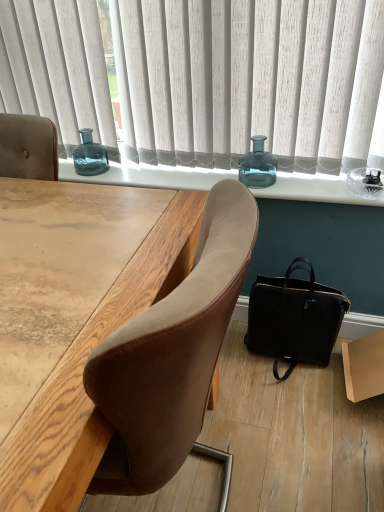
Question: Considering the relative sizes of teal glass bottle at upper center, which is counted as the first bottle, starting from the back, and brown cardboard box at lower right in the image provided, is teal glass bottle at upper center, which is counted as the first bottle, starting from the back, taller than brown cardboard box at lower right?

Choices:
 (A) yes
 (B) no

Answer: (B)

Question: Does teal glass bottle at upper center, arranged as the 2th bottle when viewed from the front, lie in front of brown cardboard box at lower right?

Choices:
 (A) yes
 (B) no

Answer: (B)

Question: From the image's perspective, is teal glass bottle at upper center, which is counted as the first bottle, starting from the back, located beneath brown cardboard box at lower right?

Choices:
 (A) no
 (B) yes

Answer: (A)

Question: Is teal glass bottle at upper center, the 2th bottle viewed from the right, positioned beyond the bounds of brown cardboard box at lower right?

Choices:
 (A) yes
 (B) no

Answer: (A)

Question: Is teal glass bottle at upper center, the 2th bottle viewed from the right, turned away from brown cardboard box at lower right?

Choices:
 (A) no
 (B) yes

Answer: (A)

Question: In terms of width, does teal glass vase at center look wider or thinner when compared to white fabric curtain at upper center?

Choices:
 (A) wide
 (B) thin

Answer: (A)

Question: Is teal glass vase at center taller or shorter than white fabric curtain at upper center?

Choices:
 (A) tall
 (B) short

Answer: (B)

Question: Would you say teal glass vase at center is to the left or to the right of white fabric curtain at upper center in the picture?

Choices:
 (A) right
 (B) left

Answer: (A)

Question: From the image's perspective, is teal glass vase at center positioned above or below white fabric curtain at upper center?

Choices:
 (A) below
 (B) above

Answer: (A)

Question: From their relative heights in the image, would you say black leather handbag at lower right is taller or shorter than wooden desk at center?

Choices:
 (A) short
 (B) tall

Answer: (A)

Question: Would you say black leather handbag at lower right is to the left or to the right of wooden desk at center in the picture?

Choices:
 (A) left
 (B) right

Answer: (B)

Question: Does point (286, 352) appear closer or farther from the camera than point (79, 456)?

Choices:
 (A) farther
 (B) closer

Answer: (A)

Question: In terms of width, does black leather handbag at lower right look wider or thinner when compared to wooden desk at center?

Choices:
 (A) thin
 (B) wide

Answer: (A)

Question: In terms of width, does teal glass vase at center look wider or thinner when compared to brown cardboard box at lower right?

Choices:
 (A) wide
 (B) thin

Answer: (B)

Question: In terms of size, does teal glass vase at center appear bigger or smaller than brown cardboard box at lower right?

Choices:
 (A) small
 (B) big

Answer: (A)